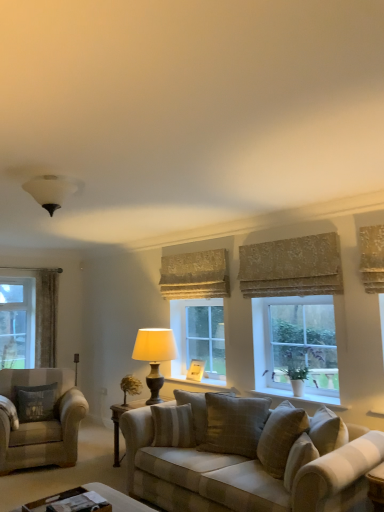
Find the location of `textured beige curtain at upper center, positioned as the 1th curtain in front-to-back order`. textured beige curtain at upper center, positioned as the 1th curtain in front-to-back order is located at coordinates (291, 267).

Describe the element at coordinates (245, 456) in the screenshot. I see `plaid fabric couch at center` at that location.

Describe the element at coordinates (199, 336) in the screenshot. I see `clear glass window at center, the 1th window from the right` at that location.

What do you see at coordinates (40, 421) in the screenshot? The image size is (384, 512). I see `beige fabric armchair at left` at bounding box center [40, 421].

Locate an element on the screen. The image size is (384, 512). green leafy plant at center is located at coordinates (130, 386).

What is the approximate height of green leafy plant at center?

It is 12.63 inches.

Identify the location of clear glass window at left, which is the first window in left-to-right order. The image size is (384, 512). (44, 314).

Would you say beige fabric armchair at left is a long distance from textured gray pillow at center, acting as the 1th pillow starting from the right?

Indeed, beige fabric armchair at left is not near textured gray pillow at center, acting as the 1th pillow starting from the right.

Is textured gray pillow at center, arranged as the 1th pillow when viewed from the front, inside beige fabric armchair at left?

No, textured gray pillow at center, arranged as the 1th pillow when viewed from the front, is not surrounded by beige fabric armchair at left.

Between beige fabric armchair at left and textured gray pillow at center, acting as the 1th pillow starting from the right, which one has smaller size?

With smaller size is textured gray pillow at center, acting as the 1th pillow starting from the right.

Is point (186, 446) positioned in front of point (167, 343)?

Yes, it is in front of point (167, 343).

Is beige textured pillow at center, the 2th pillow viewed from the front, in front of or behind matte beige lamp at window, the 1th lamp from the back, in the image?

In the image, beige textured pillow at center, the 2th pillow viewed from the front, appears in front of matte beige lamp at window, the 1th lamp from the back.

Is beige textured pillow at center, which ranks as the 2th pillow in back-to-front order, with matte beige lamp at window, which appears as the first lamp when viewed from the right?

No, beige textured pillow at center, which ranks as the 2th pillow in back-to-front order, is not with matte beige lamp at window, which appears as the first lamp when viewed from the right.

From their relative heights in the image, would you say beige textured pillow at center, which ranks as the 2th pillow in back-to-front order, is taller or shorter than matte beige lamp at window, which appears as the first lamp when viewed from the right?

beige textured pillow at center, which ranks as the 2th pillow in back-to-front order, is shorter than matte beige lamp at window, which appears as the first lamp when viewed from the right.

Locate an element on the screen. Image resolution: width=384 pixels, height=512 pixels. window that is the 1st object located below the white matte lampshade at upper center, which ranks as the second lamp in bottom-to-top order (from the image's perspective) is located at coordinates (199, 336).

Which object is wider, white matte lampshade at upper center, which ranks as the second lamp in bottom-to-top order, or clear glass window at center, the 1th window from the right?

white matte lampshade at upper center, which ranks as the second lamp in bottom-to-top order, is wider.

Does point (47, 206) appear closer or farther from the camera than point (176, 327)?

Point (47, 206).

Measure the distance between white matte lampshade at upper center, which is the 1th lamp from top to bottom, and clear glass window at center, the 1th window positioned from the front.

A distance of 2.51 meters exists between white matte lampshade at upper center, which is the 1th lamp from top to bottom, and clear glass window at center, the 1th window positioned from the front.

Could clear glass window at center be considered to be inside clear glass window at center, the 1th window from the right?

No, clear glass window at center, the 1th window from the right, does not contain clear glass window at center.

Considering the relative sizes of clear glass window at center, the 1th window from the right, and clear glass window at center in the image provided, is clear glass window at center, the 1th window from the right, wider than clear glass window at center?

Indeed, clear glass window at center, the 1th window from the right, has a greater width compared to clear glass window at center.

From the image's perspective, does clear glass window at center, positioned as the second window in back-to-front order, appear higher than clear glass window at center?

Actually, clear glass window at center, positioned as the second window in back-to-front order, appears below clear glass window at center in the image.

What's the angular difference between clear glass window at center, the 1th window positioned from the front, and clear glass window at center's facing directions?

clear glass window at center, the 1th window positioned from the front, and clear glass window at center are facing 1.28 degrees away from each other.

From a real-world perspective, is wooden at center below textured beige curtain at upper center, positioned as the 1th curtain in front-to-back order?

Yes.

Do you think wooden at center is within textured beige curtain at upper center, positioned as the 1th curtain in front-to-back order, or outside of it?

wooden at center is not inside textured beige curtain at upper center, positioned as the 1th curtain in front-to-back order, it's outside.

Between wooden at center and textured beige curtain at upper center, acting as the 3th curtain starting from the left, which one has smaller size?

wooden at center.

Which is behind, wooden at center or textured beige curtain at upper center, acting as the 3th curtain starting from the left?

Positioned behind is wooden at center.

Is point (173, 417) positioned in front of point (43, 409)?

Yes, point (173, 417) is in front of point (43, 409).

From a real-world perspective, between beige textured pillow at center, which ranks as the 2th pillow in back-to-front order, and dark gray fabric pillow at left, the third pillow positioned from the front, who is vertically lower?

beige textured pillow at center, which ranks as the 2th pillow in back-to-front order, is physically lower.

Is beige textured pillow at center, placed as the 2th pillow when sorted from right to left, behind dark gray fabric pillow at left, which appears as the first pillow when viewed from the back?

No, beige textured pillow at center, placed as the 2th pillow when sorted from right to left, is in front of dark gray fabric pillow at left, which appears as the first pillow when viewed from the back.

Measure the distance from beige textured pillow at center, which ranks as the 2th pillow in back-to-front order, to dark gray fabric pillow at left, which appears as the third pillow when viewed from the right.

beige textured pillow at center, which ranks as the 2th pillow in back-to-front order, and dark gray fabric pillow at left, which appears as the third pillow when viewed from the right, are 1.67 meters apart from each other.

From the image's perspective, relative to clear glass window at center, is dark gray fabric pillow at left, the 1th pillow positioned from the left, above or below?

From the image's perspective, dark gray fabric pillow at left, the 1th pillow positioned from the left, appears below clear glass window at center.

Can you see dark gray fabric pillow at left, the 1th pillow positioned from the left, touching clear glass window at center?

No, dark gray fabric pillow at left, the 1th pillow positioned from the left, is not in contact with clear glass window at center.

Consider the image. Between dark gray fabric pillow at left, the 1th pillow positioned from the left, and clear glass window at center, which one appears on the left side from the viewer's perspective?

From the viewer's perspective, dark gray fabric pillow at left, the 1th pillow positioned from the left, appears more on the left side.

Who is bigger, dark gray fabric pillow at left, which appears as the third pillow when viewed from the right, or clear glass window at center?

clear glass window at center.

Identify the location of chair on the left of the textured gray pillow at center, acting as the 1th pillow starting from the right. click(40, 421).

From the image's perspective, which lamp is the 1st one above the beige textured pillow at center, which ranks as the 2th pillow in back-to-front order? Please provide its 2D coordinates.

[(154, 356)]

Considering their positions, is textured beige curtain at center, which is the second curtain in front-to-back order, positioned closer to dark gray fabric pillow at left, the 1th pillow positioned from the left, than textured gray pillow at center, acting as the 1th pillow starting from the right?

textured beige curtain at center, which is the second curtain in front-to-back order.

Estimate the real-world distances between objects in this image. Which object is further from textured beige curtain at center, positioned as the second curtain in right-to-left order, white matte lampshade at upper center, the first lamp from the front, or velvet curtain at left, placed as the third curtain when sorted from right to left?

velvet curtain at left, placed as the third curtain when sorted from right to left, lies further to textured beige curtain at center, positioned as the second curtain in right-to-left order, than the other object.

From the image, which object appears to be farther from white matte lampshade at upper center, which is the 2th lamp from right to left, clear glass window at center or wooden coffee table at lower center?

clear glass window at center lies further to white matte lampshade at upper center, which is the 2th lamp from right to left, than the other object.

From the image, which object appears to be nearer to green leafy plant at center, beige fabric armchair at left or textured gray pillow at center, acting as the 1th pillow starting from the right?

The object closer to green leafy plant at center is beige fabric armchair at left.

Which object lies nearer to the anchor point wooden coffee table at lower center, beige fabric armchair at left or textured beige curtain at upper center, acting as the 3th curtain starting from the left?

beige fabric armchair at left lies closer to wooden coffee table at lower center than the other object.

Estimate the real-world distances between objects in this image. Which object is closer to textured beige curtain at upper center, acting as the 3th curtain starting from the left, clear glass window at center, which is counted as the second window, starting from the left, or clear glass window at center?

clear glass window at center lies closer to textured beige curtain at upper center, acting as the 3th curtain starting from the left, than the other object.

Which object lies nearer to the anchor point clear glass window at left, which appears as the second window when viewed from the right, beige fabric armchair at left or green leafy plant at center?

beige fabric armchair at left is positioned closer to the anchor clear glass window at left, which appears as the second window when viewed from the right.

From the image, which object appears to be farther from beige fabric armchair at left, wooden at center or green leafy plant at center?

Based on the image, wooden at center appears to be further to beige fabric armchair at left.

The image size is (384, 512). Identify the location of window located between beige fabric armchair at left and textured beige curtain at upper center, which is the 1th curtain in right-to-left order, in the left-right direction. (199, 336).

You are a GUI agent. You are given a task and a screenshot of the screen. Output one action in this format:
    pyautogui.click(x=<x>, y=<y>)
    Task: Click on the lamp between white matte lampshade at upper center, which is the 1th lamp from top to bottom, and velvet curtain at left, placed as the third curtain when sorted from right to left, in the front-back direction
    The image size is (384, 512).
    Given the screenshot: What is the action you would take?
    pyautogui.click(x=154, y=356)

The image size is (384, 512). I want to click on window sill between matte beige lamp at window, which appears as the first lamp when viewed from the right, and clear glass window at center, the 1th window positioned from the front, so [198, 381].

Image resolution: width=384 pixels, height=512 pixels. What are the coordinates of `houseplant between textured beige curtain at center, which is the second curtain in front-to-back order, and wooden at center from top to bottom` in the screenshot? It's located at (130, 386).